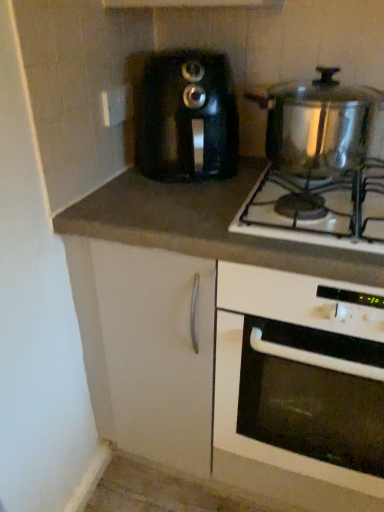
You are a GUI agent. You are given a task and a screenshot of the screen. Output one action in this format:
    pyautogui.click(x=<x>, y=<y>)
    Task: Click on the empty space that is ontop of dark gray laminate countertop at center (from a real-world perspective)
    
    Given the screenshot: What is the action you would take?
    pyautogui.click(x=158, y=195)